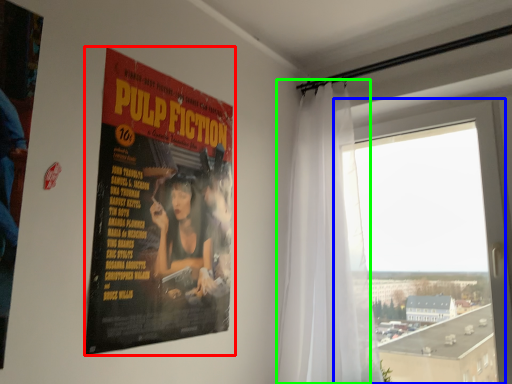
Question: Based on their relative distances, which object is farther from poster (highlighted by a red box)? Choose from window (highlighted by a blue box) and curtain (highlighted by a green box).

Choices:
 (A) window
 (B) curtain

Answer: (A)